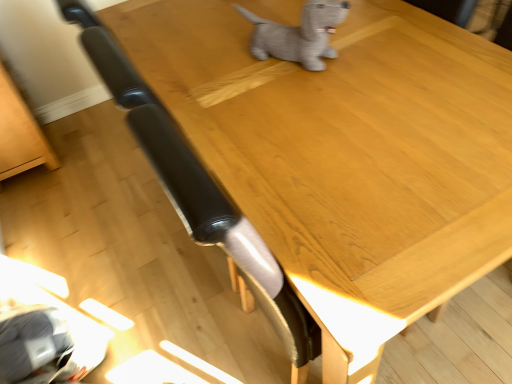
At what (x,y) coordinates should I click in order to perform the action: click on gray plush dog at upper center. Please return your answer as a coordinate pair (x, y). Image resolution: width=512 pixels, height=384 pixels. Looking at the image, I should click on (298, 34).

Describe the element at coordinates (298, 34) in the screenshot. I see `gray plush dog at upper center` at that location.

Identify the location of light brown wood table at lower left. This screenshot has height=384, width=512. (20, 134).

What is the approximate height of light brown wood table at lower left?

light brown wood table at lower left is 29.75 inches tall.

The image size is (512, 384). Describe the element at coordinates (20, 134) in the screenshot. I see `light brown wood table at lower left` at that location.

Where is `gray plush dog at upper center`? Image resolution: width=512 pixels, height=384 pixels. gray plush dog at upper center is located at coordinates (298, 34).

Which object is positioned more to the right, light brown wood table at lower left or gray plush dog at upper center?

From the viewer's perspective, gray plush dog at upper center appears more on the right side.

Considering their positions, is light brown wood table at lower left located in front of or behind gray plush dog at upper center?

In the image, light brown wood table at lower left appears behind gray plush dog at upper center.

Considering the positions of point (8, 136) and point (287, 55), is point (8, 136) closer or farther from the camera than point (287, 55)?

Point (8, 136).

From the image's perspective, is light brown wood table at lower left on gray plush dog at upper center?

Actually, light brown wood table at lower left appears below gray plush dog at upper center in the image.

From a real-world perspective, which object stands above the other?

gray plush dog at upper center, from a real-world perspective.

Does light brown wood table at lower left have a greater width compared to gray plush dog at upper center?

Yes.

Is light brown wood table at lower left taller than gray plush dog at upper center?

Correct, light brown wood table at lower left is much taller as gray plush dog at upper center.

Who is smaller, light brown wood table at lower left or gray plush dog at upper center?

gray plush dog at upper center is smaller.

Is light brown wood table at lower left completely or partially outside of gray plush dog at upper center?

Yes, light brown wood table at lower left is located beyond the bounds of gray plush dog at upper center.

Is light brown wood table at lower left far from gray plush dog at upper center?

Absolutely, light brown wood table at lower left is distant from gray plush dog at upper center.

Is gray plush dog at upper center at the back of light brown wood table at lower left?

No, light brown wood table at lower left is not facing the opposite direction of gray plush dog at upper center.

This screenshot has height=384, width=512. In order to click on dog on the right of light brown wood table at lower left in this screenshot , I will do `click(298, 34)`.

Between gray plush dog at upper center and light brown wood table at lower left, which one appears on the left side from the viewer's perspective?

light brown wood table at lower left.

Is gray plush dog at upper center behind light brown wood table at lower left?

No.

Does point (259, 35) come closer to viewer compared to point (21, 152)?

Yes, it is.

From the image's perspective, which object appears higher, gray plush dog at upper center or light brown wood table at lower left?

Result: From the image's view, gray plush dog at upper center is above.

From a real-world perspective, is gray plush dog at upper center over light brown wood table at lower left?

Correct, in the physical world, gray plush dog at upper center is higher than light brown wood table at lower left.

In terms of width, does gray plush dog at upper center look wider or thinner when compared to light brown wood table at lower left?

Considering their sizes, gray plush dog at upper center looks slimmer than light brown wood table at lower left.

From their relative heights in the image, would you say gray plush dog at upper center is taller or shorter than light brown wood table at lower left?

Clearly, gray plush dog at upper center is shorter compared to light brown wood table at lower left.

Considering the relative sizes of gray plush dog at upper center and light brown wood table at lower left in the image provided, is gray plush dog at upper center bigger than light brown wood table at lower left?

No, gray plush dog at upper center is not bigger than light brown wood table at lower left.

Is gray plush dog at upper center outside of light brown wood table at lower left?

That's correct, gray plush dog at upper center is outside of light brown wood table at lower left.

Is gray plush dog at upper center not close to light brown wood table at lower left?

That's right, there is a large distance between gray plush dog at upper center and light brown wood table at lower left.

Could you tell me if gray plush dog at upper center is facing light brown wood table at lower left?

No, gray plush dog at upper center is not facing towards light brown wood table at lower left.

Measure the distance between gray plush dog at upper center and light brown wood table at lower left.

gray plush dog at upper center is 1.44 meters from light brown wood table at lower left.

Locate an element on the screen. This screenshot has height=384, width=512. furniture below the gray plush dog at upper center (from the image's perspective) is located at coordinates (20, 134).

Where is `dog located in front of the light brown wood table at lower left`? The image size is (512, 384). dog located in front of the light brown wood table at lower left is located at coordinates (298, 34).

Identify the location of furniture to the left of gray plush dog at upper center. Image resolution: width=512 pixels, height=384 pixels. (20, 134).